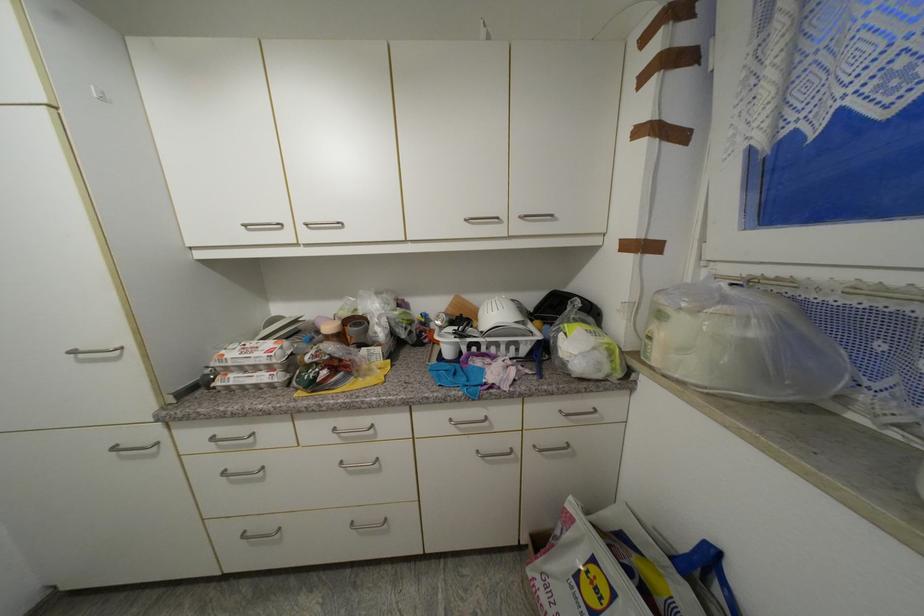
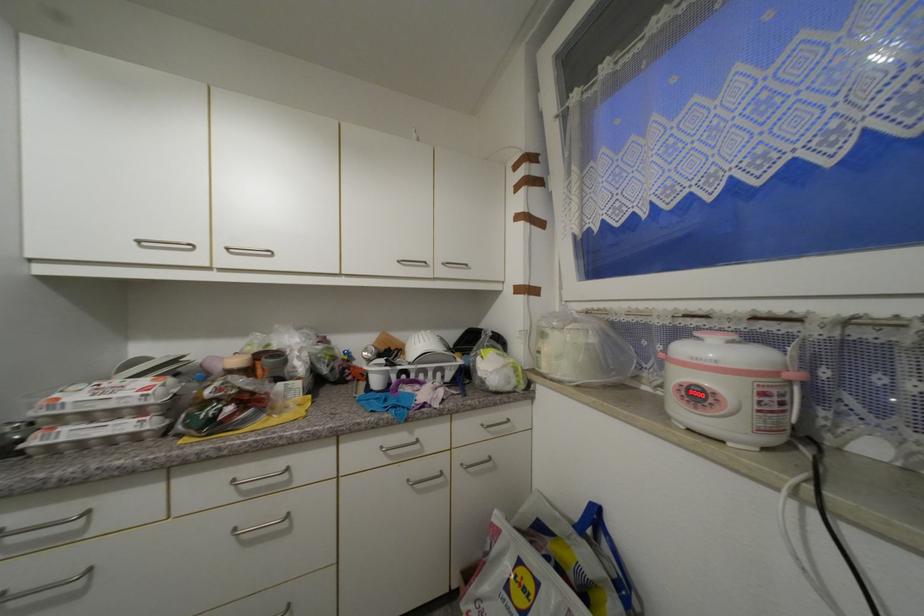
Where in the second image is the point corresponding to pixel 541 448 from the first image?

(468, 467)